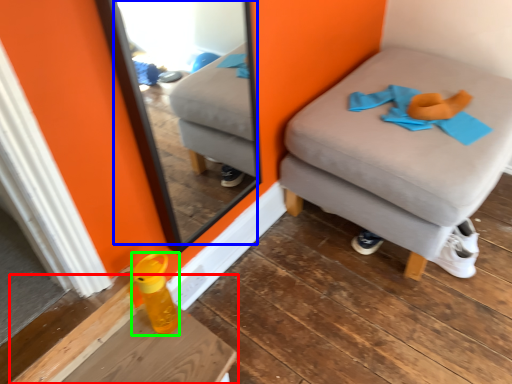
Question: Considering the real-world distances, which object is farthest from table (highlighted by a red box)? mirror (highlighted by a blue box) or bottle (highlighted by a green box)?

Choices:
 (A) mirror
 (B) bottle

Answer: (A)